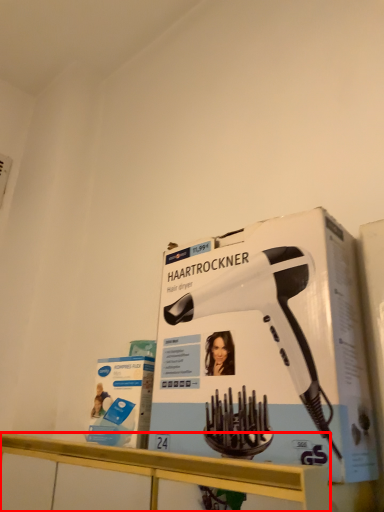
Question: In this image, where is counter (annotated by the red box) located relative to hair drier?

Choices:
 (A) left
 (B) right

Answer: (A)